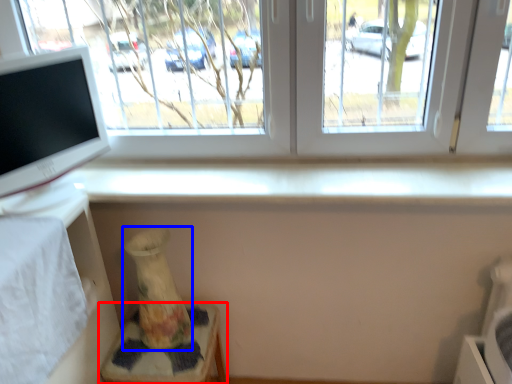
Question: Which object appears farthest to the camera in this image, furniture (highlighted by a red box) or vase (highlighted by a blue box)?

Choices:
 (A) furniture
 (B) vase

Answer: (A)